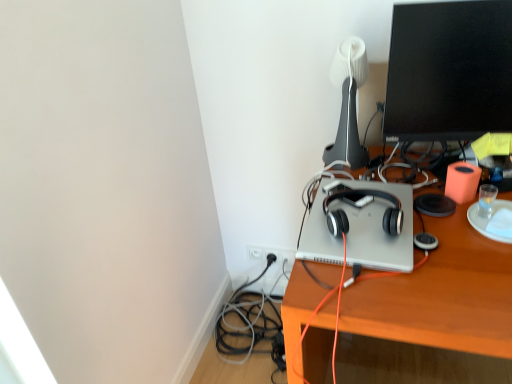
Where is `blank space situated above wooden desk at center (from a real-world perspective)`? blank space situated above wooden desk at center (from a real-world perspective) is located at coordinates (428, 221).